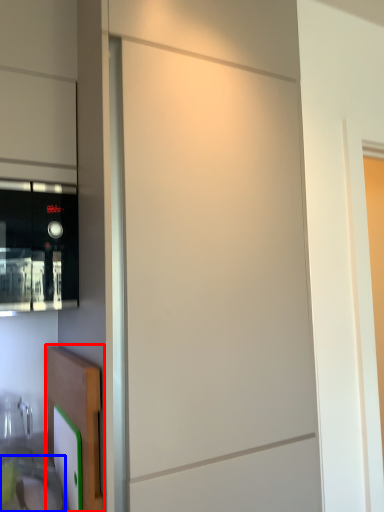
Question: Which object is closer to the camera taking this photo, cabinetry (highlighted by a red box) or sink (highlighted by a blue box)?

Choices:
 (A) cabinetry
 (B) sink

Answer: (B)